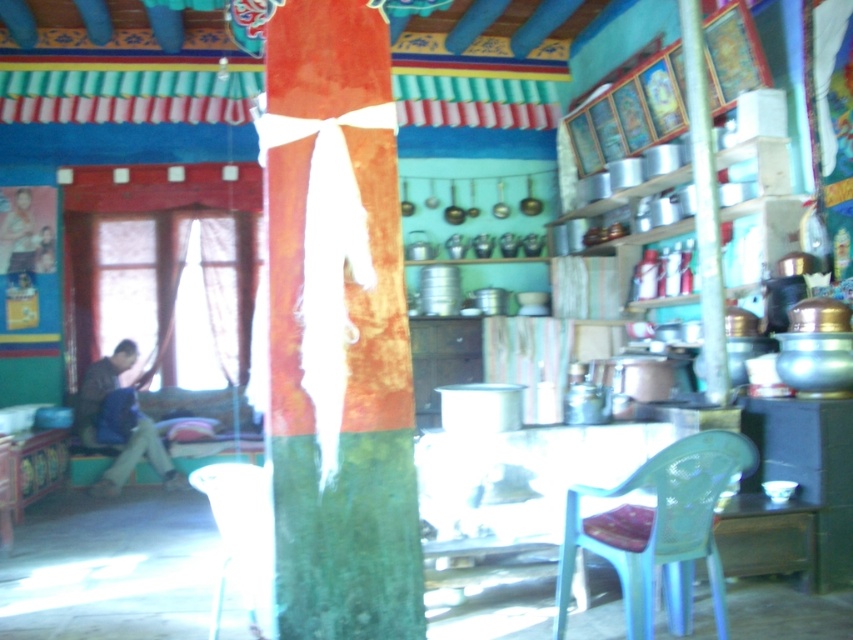
You are standing in the room and want to move from the window to the door located near the pillar. Which object would you need to pass by first, the metallic pole at right or the translucent plastic chair at lower center?

You would need to pass by the metallic pole at right first because the translucent plastic chair at lower center is behind it, meaning the metallic pole is closer to your starting position at the window.